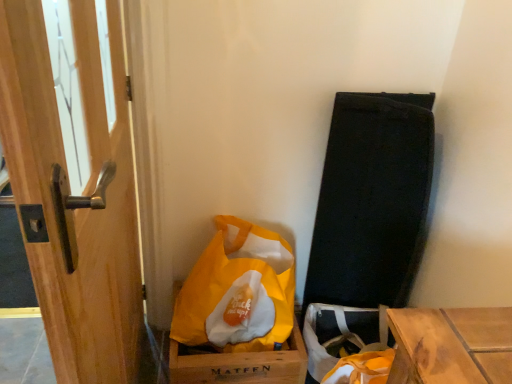
Question: Is yellow matte cardboard box at lower center closer to camera compared to wooden door handle at left?

Choices:
 (A) yes
 (B) no

Answer: (B)

Question: Is yellow matte cardboard box at lower center not within wooden door handle at left?

Choices:
 (A) yes
 (B) no

Answer: (A)

Question: Does yellow matte cardboard box at lower center come behind wooden door handle at left?

Choices:
 (A) no
 (B) yes

Answer: (B)

Question: Does yellow matte cardboard box at lower center appear on the right side of wooden door handle at left?

Choices:
 (A) no
 (B) yes

Answer: (B)

Question: Could you tell me if yellow matte cardboard box at lower center is facing wooden door handle at left?

Choices:
 (A) no
 (B) yes

Answer: (A)

Question: From the image's perspective, is yellow fabric bag at lower center located above or below wooden door handle at left?

Choices:
 (A) above
 (B) below

Answer: (B)

Question: Based on their sizes in the image, would you say yellow fabric bag at lower center is bigger or smaller than wooden door handle at left?

Choices:
 (A) small
 (B) big

Answer: (A)

Question: Considering the positions of point (227, 301) and point (34, 193), is point (227, 301) closer or farther from the camera than point (34, 193)?

Choices:
 (A) farther
 (B) closer

Answer: (A)

Question: In the image, is yellow fabric bag at lower center positioned in front of or behind wooden door handle at left?

Choices:
 (A) behind
 (B) front

Answer: (A)

Question: From a real-world perspective, is wooden door handle at left positioned above or below yellow fabric bag at lower center?

Choices:
 (A) below
 (B) above

Answer: (B)

Question: Is wooden door handle at left inside or outside of yellow fabric bag at lower center?

Choices:
 (A) outside
 (B) inside

Answer: (A)

Question: Is wooden door handle at left wider or thinner than yellow fabric bag at lower center?

Choices:
 (A) wide
 (B) thin

Answer: (B)

Question: Is wooden door handle at left taller or shorter than yellow fabric bag at lower center?

Choices:
 (A) tall
 (B) short

Answer: (A)

Question: Visually, is yellow fabric bag at lower center positioned to the left or to the right of yellow matte cardboard box at lower center?

Choices:
 (A) right
 (B) left

Answer: (A)

Question: Looking at the image, does yellow fabric bag at lower center seem bigger or smaller compared to yellow matte cardboard box at lower center?

Choices:
 (A) small
 (B) big

Answer: (B)